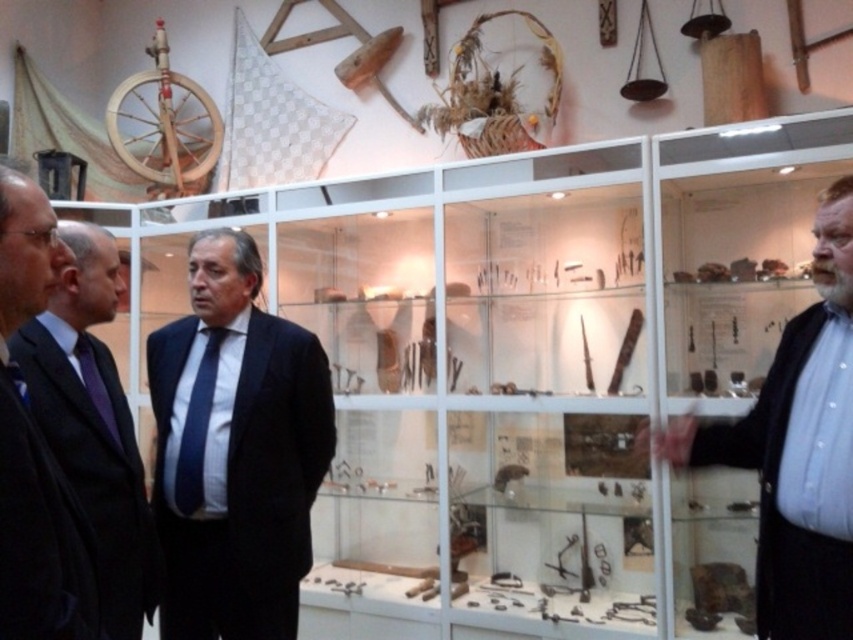
You are standing in the museum and see the black wool suit at left and the blue striped tie at center. Which one is higher up in the image?

The black wool suit at left is above the blue striped tie at center, so it is higher up in the image.

You are a photographer in the room and want to take a photo of the dark blue suit at center and the black wool suit at left. From your current position, which one is lower in the frame?

The dark blue suit at center is located below the black wool suit at left, so the dark blue suit at center will appear lower in the frame.